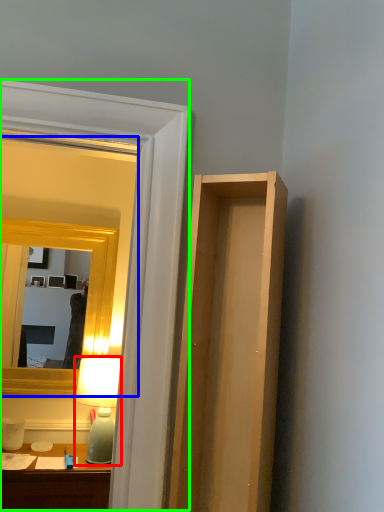
Question: Considering the real-world distances, which object is farthest from table lamp (highlighted by a red box)? mirror (highlighted by a blue box) or glass door (highlighted by a green box)?

Choices:
 (A) mirror
 (B) glass door

Answer: (B)